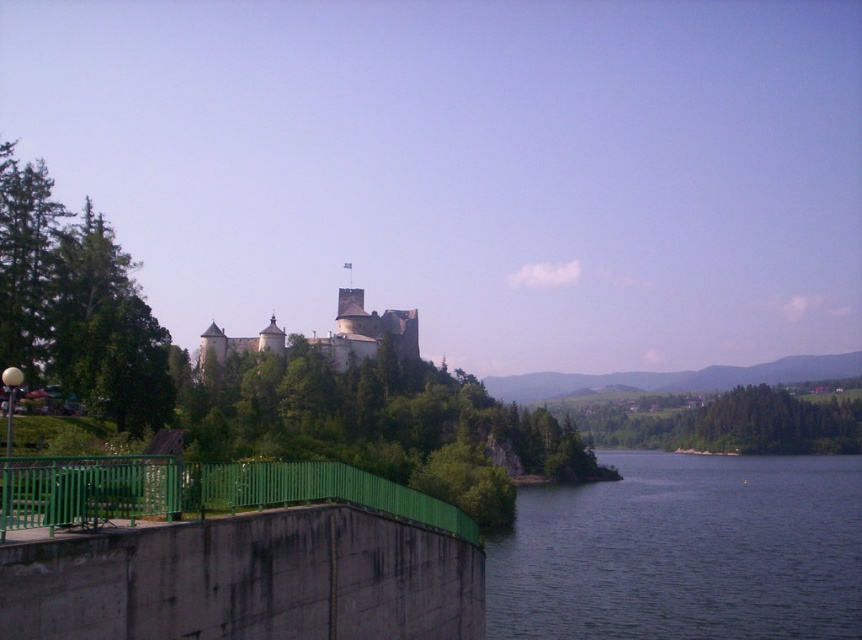
You are standing on the viewing platform and want to take a photo of the castle. You notice the dark blue water at lower right and the green metallic fence at lower left in your camera frame. Which object is positioned lower in the image?

The dark blue water at lower right is positioned lower in the image than the green metallic fence at lower left.

You are standing at the viewing platform and want to walk towards the stone castle at center. The green metallic fence at lower left is in your path. Can you walk through the fence?

The green metallic fence at lower left is thinner than the stone castle at center, but the fence is a physical barrier blocking your path. You cannot walk through the fence itself as it is solid.

You are standing at the viewing platform and want to take a photo of both the dark blue water at lower right and the green metallic fence at lower left. Which object will occupy more space in your photo?

The dark blue water at lower right will occupy more space in the photo because its width is larger than the green metallic fence at lower left.